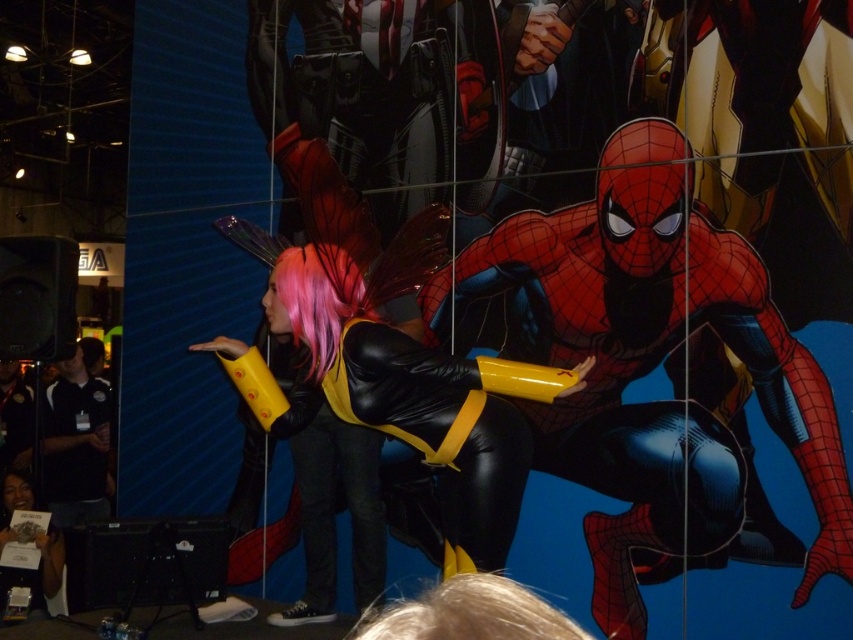
Question: Can you confirm if red matte spider-man at center is positioned below black matte/yellow leather gloves at center?

Choices:
 (A) yes
 (B) no

Answer: (A)

Question: Is black matte/yellow leather gloves at center bigger than black jersey at left?

Choices:
 (A) yes
 (B) no

Answer: (A)

Question: Among these points, which one is farthest from the camera?

Choices:
 (A) click(x=618, y=321)
 (B) click(x=503, y=483)
 (C) click(x=80, y=388)

Answer: (C)

Question: Which point is farther to the camera?

Choices:
 (A) (48, 486)
 (B) (514, 332)

Answer: (A)

Question: Which is nearer to the black matte/yellow leather gloves at center?

Choices:
 (A) red matte spider-man at center
 (B) black jersey at left

Answer: (A)

Question: Does black matte/yellow leather gloves at center appear on the left side of black jersey at left?

Choices:
 (A) no
 (B) yes

Answer: (A)